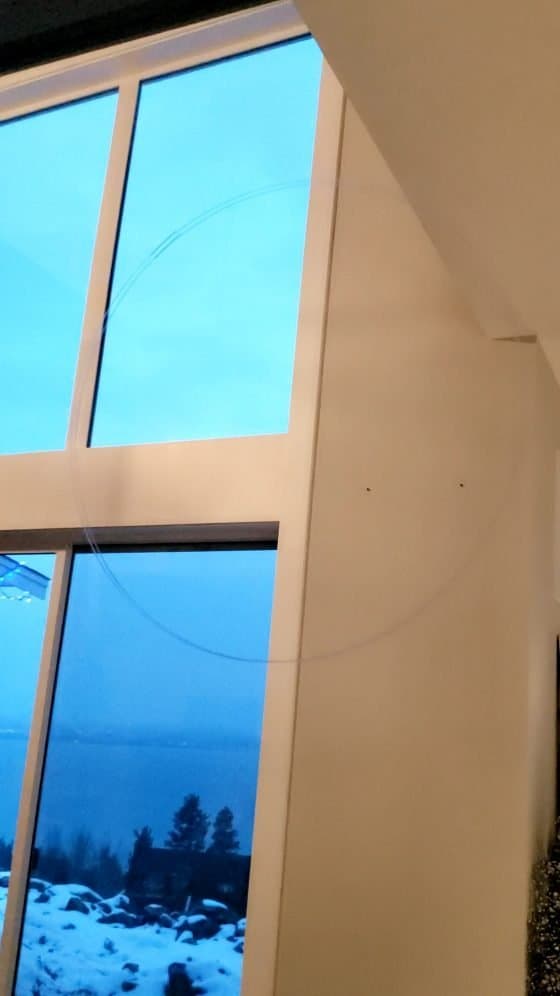
The width and height of the screenshot is (560, 996). What are the coordinates of `window framing` in the screenshot? It's located at (34, 759), (88, 342), (152, 481).